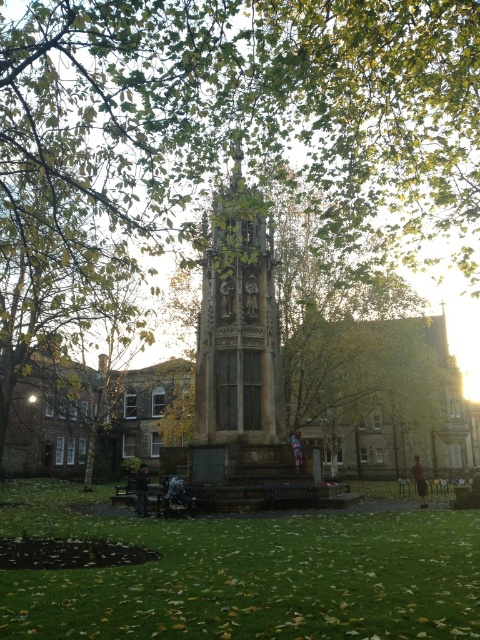
Question: Which point is closer to the camera?

Choices:
 (A) (412, 522)
 (B) (214, 483)

Answer: (A)

Question: Can you confirm if green grass at lower center is positioned below stone statue at center?

Choices:
 (A) no
 (B) yes

Answer: (B)

Question: Among these points, which one is nearest to the camera?

Choices:
 (A) (168, 554)
 (B) (207, 422)

Answer: (A)

Question: Is the position of green grass at lower center more distant than that of stone statue at center?

Choices:
 (A) no
 (B) yes

Answer: (A)

Question: Observing the image, what is the correct spatial positioning of green grass at lower center in reference to stone statue at center?

Choices:
 (A) below
 (B) above

Answer: (A)